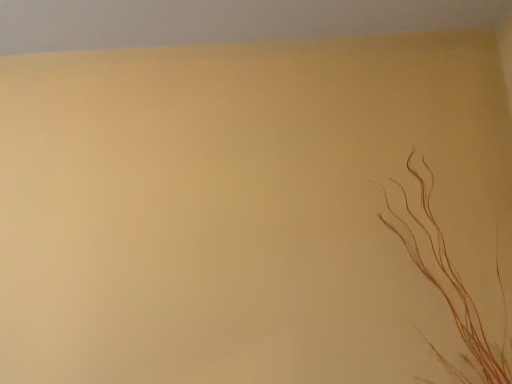
Find the location of `brown textured plant at right`. brown textured plant at right is located at coordinates (451, 289).

The image size is (512, 384). What do you see at coordinates (451, 289) in the screenshot? I see `brown textured plant at right` at bounding box center [451, 289].

Measure the distance between point (496, 263) and camera.

Point (496, 263) and camera are 4.61 feet apart from each other.

The image size is (512, 384). In order to click on brown textured plant at right in this screenshot , I will do `click(451, 289)`.